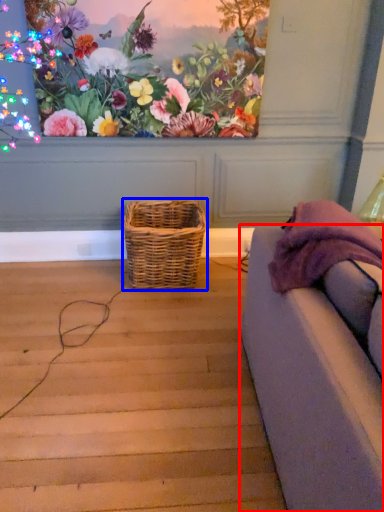
Question: Which object appears farthest to the camera in this image, studio couch (highlighted by a red box) or picnic basket (highlighted by a blue box)?

Choices:
 (A) studio couch
 (B) picnic basket

Answer: (B)